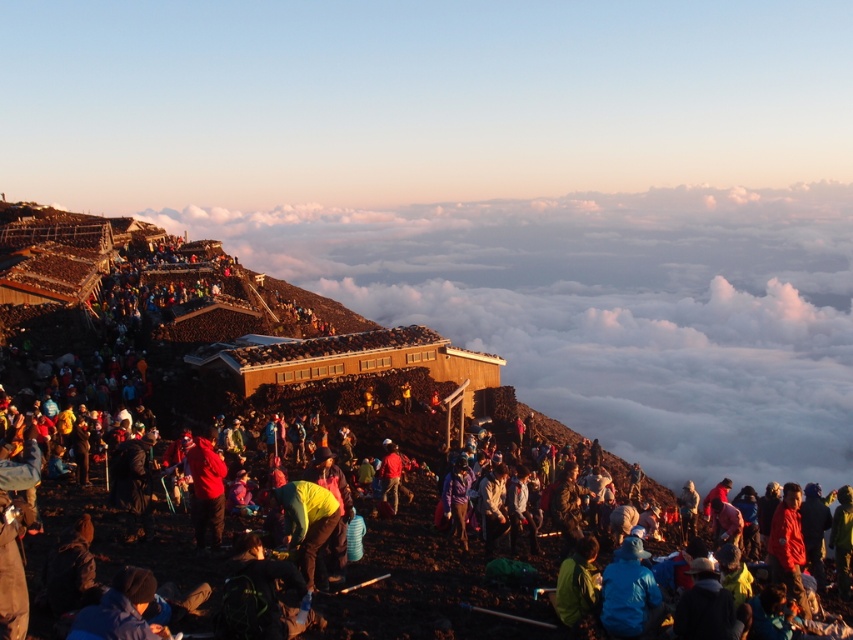
Question: Is yellow jacket at center in front of matte red jacket at center?

Choices:
 (A) no
 (B) yes

Answer: (B)

Question: Is yellow fabric at center to the left of matte red jacket at center from the viewer's perspective?

Choices:
 (A) no
 (B) yes

Answer: (A)

Question: Which object appears closest to the camera in this image?

Choices:
 (A) yellow jacket at center
 (B) yellow fabric at center
 (C) matte red jacket at center

Answer: (A)

Question: Which point is farther to the camera?

Choices:
 (A) (314, 342)
 (B) (213, 486)
 (C) (306, 540)

Answer: (A)

Question: Which point appears farthest from the camera in this image?

Choices:
 (A) (201, 467)
 (B) (547, 449)

Answer: (B)

Question: In this image, where is yellow jacket at center located relative to yellow fabric at center?

Choices:
 (A) above
 (B) below

Answer: (A)